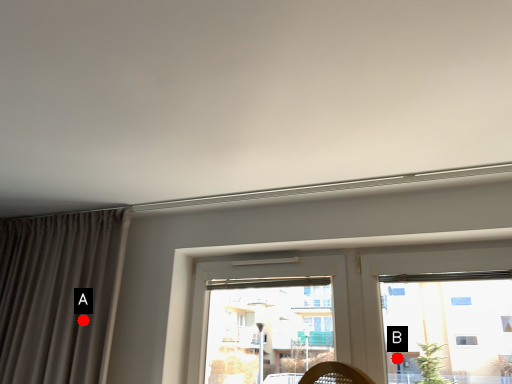
Question: Two points are circled on the image, labeled by A and B beside each circle. Which point is closer to the camera?

Choices:
 (A) A is closer
 (B) B is closer

Answer: (A)